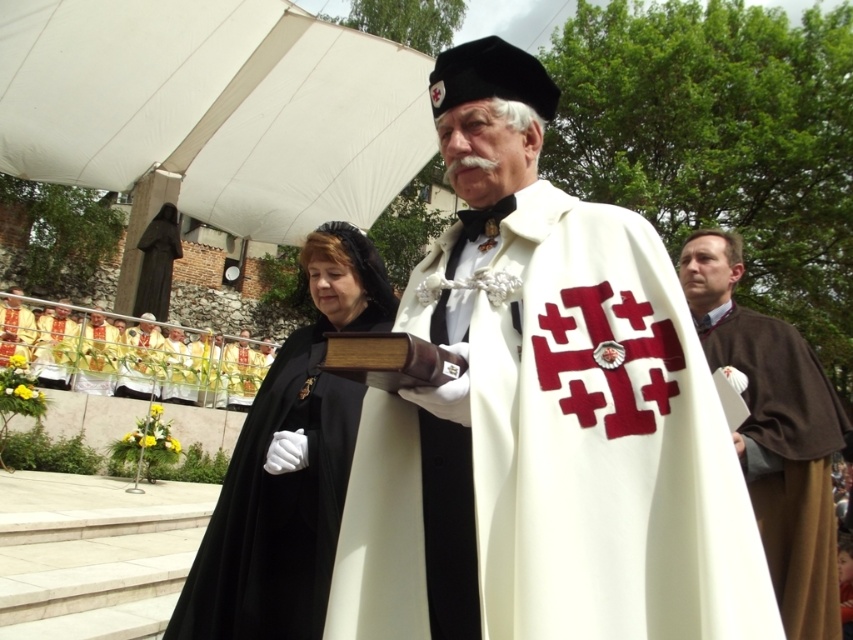
You are an event planner observing the scene. You need to ensure that the black velvet cape at center and the brown woolen robe at right are visible to all attendees. Based on their positions, which one might block the view of the other?

The black velvet cape at center is in front of the brown woolen robe at right, so the black velvet cape at center could block the view of the brown woolen robe at right.

You are an event organizer at the ceremony. You need to determine which object has a greater width between the brown woolen robe at right and the matte gold cross at lower left. Based on the scene description, which one is wider?

The matte gold cross at lower left is wider than the brown woolen robe at right.

You are attending a formal outdoor event and notice two participants wearing ceremonial attire. One is a man in a white robe with red crosses, and the other is wearing a brown woolen robe at right. Based on their positions, which robe is positioned farther to the right side of the scene?

The brown woolen robe at right is positioned farther to the right side of the scene as it is located at point 0.677 on the horizontal axis, which indicates its rightward placement compared to other elements in the image.